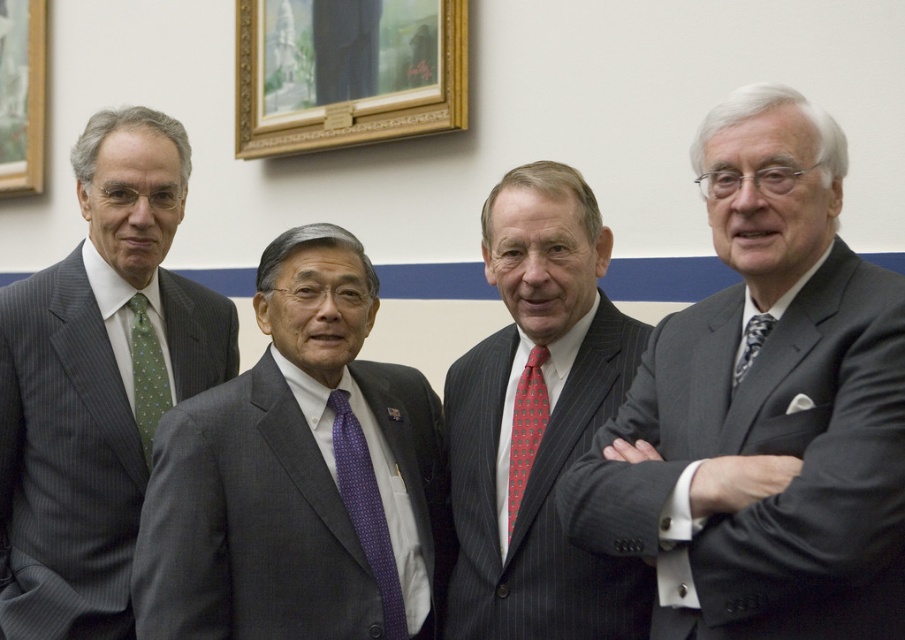
Question: Which object is farther from the camera taking this photo?

Choices:
 (A) pinstriped suit at center
 (B) gray suit at center
 (C) red dotted tie at center

Answer: (C)

Question: Which point is farther to the camera?

Choices:
 (A) (6, 436)
 (B) (807, 525)
 (C) (512, 477)
 (D) (374, 570)

Answer: (A)

Question: Does gray pinstripe suit at center appear on the left side of gray suit at center?

Choices:
 (A) no
 (B) yes

Answer: (A)

Question: From the image, what is the correct spatial relationship of purple dotted tie at center in relation to red dotted tie at center?

Choices:
 (A) right
 (B) left

Answer: (B)

Question: Which point is closer to the camera?

Choices:
 (A) (736, 387)
 (B) (496, 540)

Answer: (A)

Question: Can you confirm if gray suit at center is positioned to the right of wooden picture frame at upper left?

Choices:
 (A) no
 (B) yes

Answer: (B)